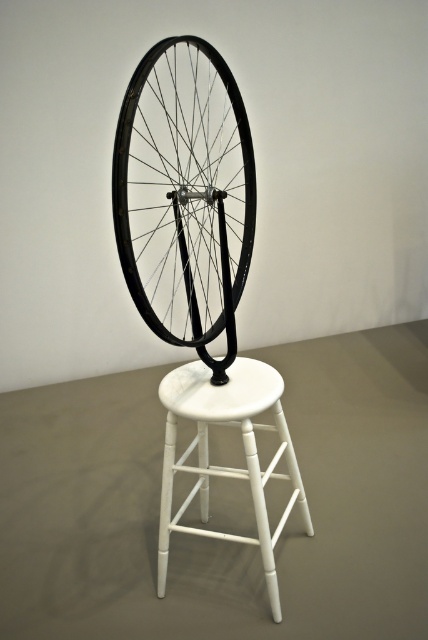
You are an interior designer planning to place a decorative item in a small living room. You have the black matte bicycle wheel at center and the white matte bar stool at center. Which object would take up more floor space due to its size?

The black matte bicycle wheel at center is bigger than the white matte bar stool at center, so it would take up more floor space.